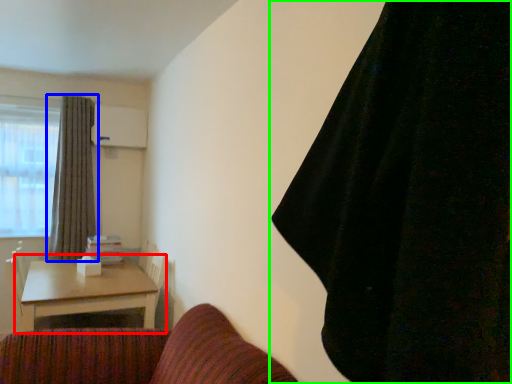
Question: Estimate the real-world distances between objects in this image. Which object is farther from table (highlighted by a red box), curtain (highlighted by a blue box) or curtain (highlighted by a green box)?

Choices:
 (A) curtain
 (B) curtain

Answer: (B)